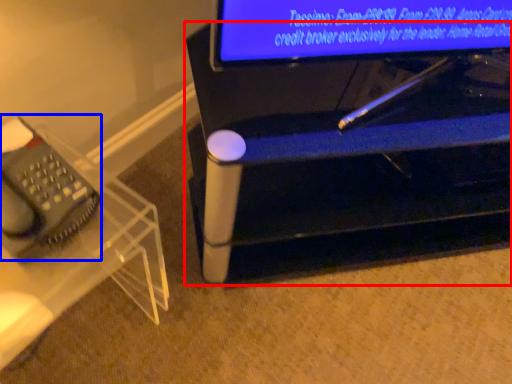
Question: Which of the following is the closest to the observer, furniture (highlighted by a red box) or equipment (highlighted by a blue box)?

Choices:
 (A) furniture
 (B) equipment

Answer: (B)